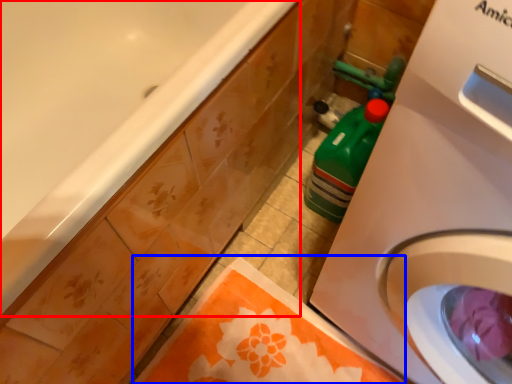
Question: Which object appears closest to the camera in this image, bathtub (highlighted by a red box) or beach towel (highlighted by a blue box)?

Choices:
 (A) bathtub
 (B) beach towel

Answer: (A)